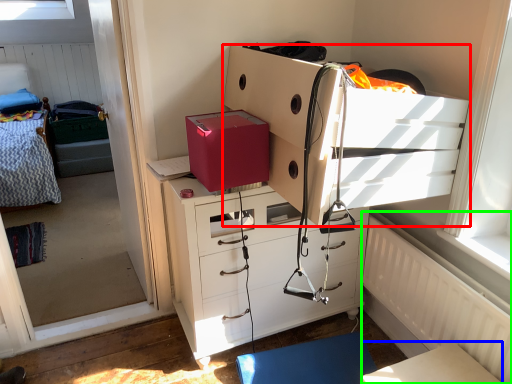
Question: Considering the real-world distances, which object is farthest from chest of drawers (highlighted by a red box)? table (highlighted by a blue box) or radiator (highlighted by a green box)?

Choices:
 (A) table
 (B) radiator

Answer: (A)